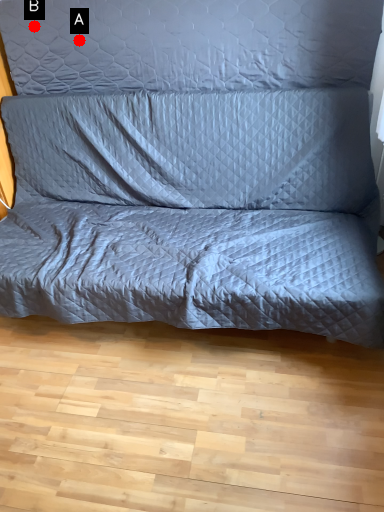
Question: Two points are circled on the image, labeled by A and B beside each circle. Which point is closer to the camera?

Choices:
 (A) A is closer
 (B) B is closer

Answer: (A)